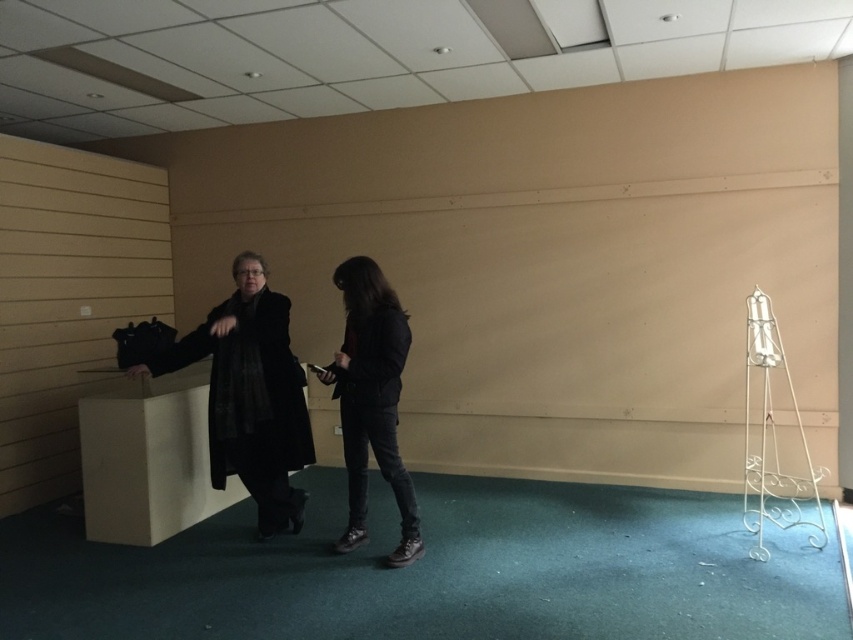
You are a tailor who needs to determine which item requires more fabric to alter between the matte black coat at left and the matte black jacket at center. Which one would need more fabric?

The matte black coat at left requires more fabric because it has a larger size compared to the matte black jacket at center.

You are standing in the room and want to move from the beige wall to the decorative metal stand on the right. Which object, the matte black coat at left or the matte black jacket at center, would you pass closer to as you walk towards the metal stand?

As you walk towards the decorative metal stand on the right, you would pass closer to the matte black jacket at center because it is positioned to the right of the matte black coat at left.

You are trying to decide which piece of clothing to take with you. The matte black coat at left and the matte black jacket at center are both available. Based on their sizes, which one takes up more space when folded?

The matte black coat at left might be wider than the matte black jacket at center, so it could take up more space when folded.